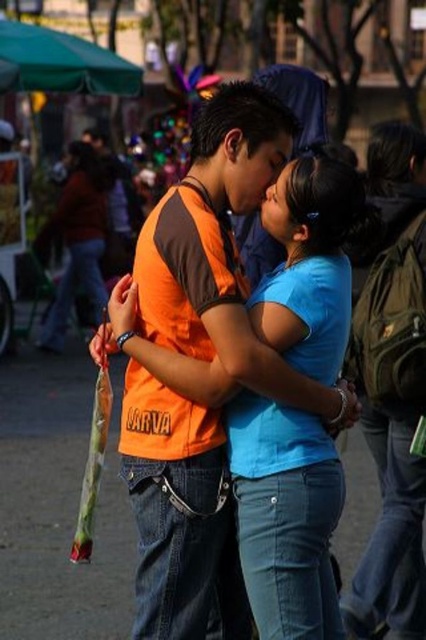
You are a photographer trying to capture a closeup of the orange cotton shirt at center. You have a focus point set at point (221, 248). Will this focus point be effective for capturing the orange cotton shirt at center?

Yes, the focus point at (221, 248) is on the orange cotton shirt at center, so it will effectively capture the shirt in focus.

Looking at this image, you are a photographer who wants to adjust the focus of your camera to ensure both the blue denim jeans at center and the blue matte shirt at center are clearly visible. Given their sizes, which object should you focus on first to maintain sharpness?

The blue denim jeans at center has a smaller size compared to blue matte shirt at center, so you should focus on the blue denim jeans at center first to ensure its details are sharp before adjusting for the larger blue matte shirt at center.

Based on the photo, you are a photographer adjusting your camera settings to focus on the orange cotton shirt at center and the blue matte shirt at center. Which shirt should you focus on first if you want to ensure both are in focus, considering their positions?

The orange cotton shirt at center is located below the blue matte shirt at center. To ensure both are in focus, focus on the blue matte shirt at center first since it is closer to the camera, allowing the orange cotton shirt at center to fall within the depth of field.